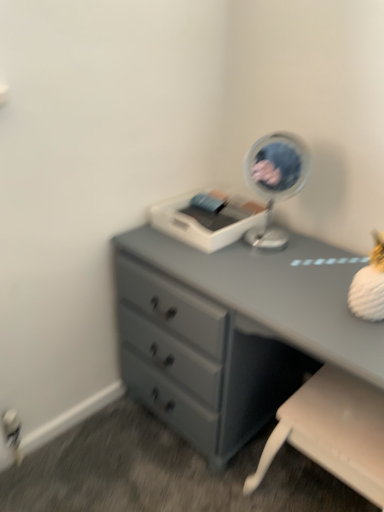
Question: Does white plastic swivel chair at lower right appear on the left side of metallic silver mirror at upper right?

Choices:
 (A) no
 (B) yes

Answer: (A)

Question: Would you consider white plastic swivel chair at lower right to be distant from metallic silver mirror at upper right?

Choices:
 (A) yes
 (B) no

Answer: (B)

Question: Is white plastic swivel chair at lower right oriented away from metallic silver mirror at upper right?

Choices:
 (A) no
 (B) yes

Answer: (A)

Question: From a real-world perspective, is white plastic swivel chair at lower right on metallic silver mirror at upper right?

Choices:
 (A) yes
 (B) no

Answer: (B)

Question: Is white plastic swivel chair at lower right beside metallic silver mirror at upper right?

Choices:
 (A) yes
 (B) no

Answer: (B)

Question: Does white plastic swivel chair at lower right come behind metallic silver mirror at upper right?

Choices:
 (A) yes
 (B) no

Answer: (B)

Question: Is matte gray dresser at center turned away from white plastic swivel chair at lower right?

Choices:
 (A) yes
 (B) no

Answer: (A)

Question: Is matte gray dresser at center aimed at white plastic swivel chair at lower right?

Choices:
 (A) no
 (B) yes

Answer: (B)

Question: From the image's perspective, does matte gray dresser at center appear lower than white plastic swivel chair at lower right?

Choices:
 (A) no
 (B) yes

Answer: (A)

Question: Considering the relative sizes of matte gray dresser at center and white plastic swivel chair at lower right in the image provided, is matte gray dresser at center taller than white plastic swivel chair at lower right?

Choices:
 (A) no
 (B) yes

Answer: (B)

Question: From a real-world perspective, does matte gray dresser at center stand above white plastic swivel chair at lower right?

Choices:
 (A) yes
 (B) no

Answer: (A)

Question: From the image's perspective, would you say matte gray dresser at center is positioned over white plastic swivel chair at lower right?

Choices:
 (A) yes
 (B) no

Answer: (A)

Question: Does metallic silver mirror at upper right have a lesser height compared to white plastic swivel chair at lower right?

Choices:
 (A) yes
 (B) no

Answer: (A)